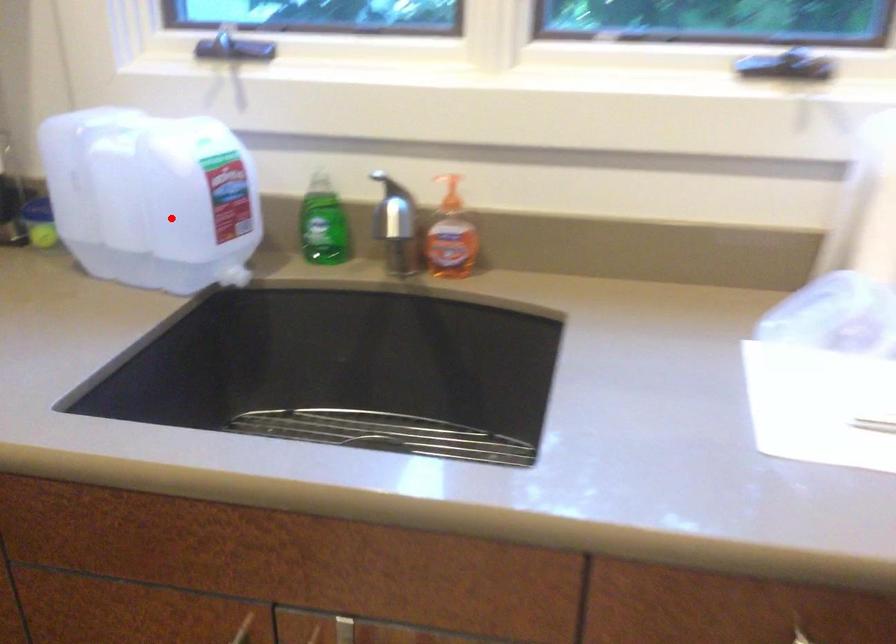
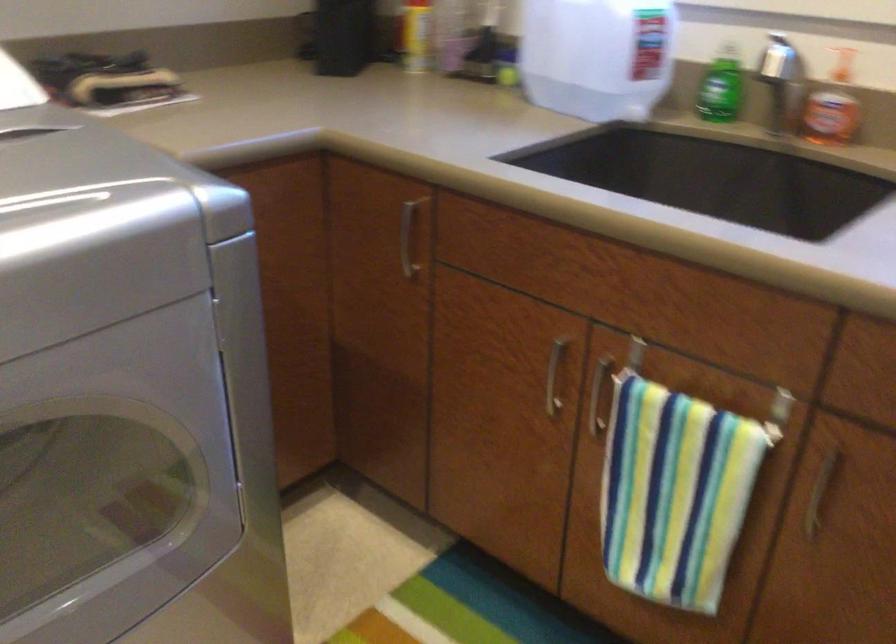
Question: I am providing you with two images of the same scene from different viewpoints. A red point is shown in image1. For the corresponding object point in image2, is it positioned nearer or farther from the camera?

Choices:
 (A) Nearer
 (B) Farther

Answer: (B)